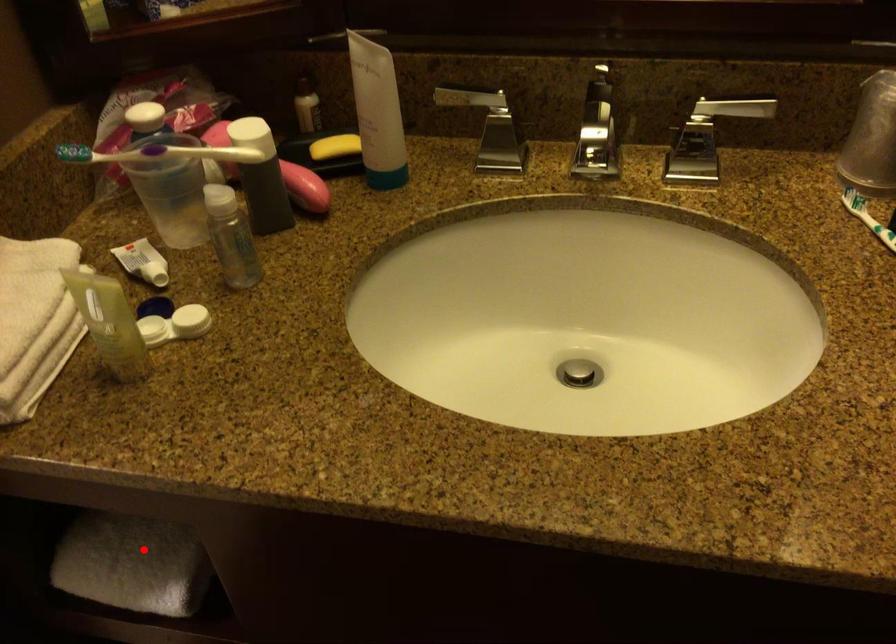
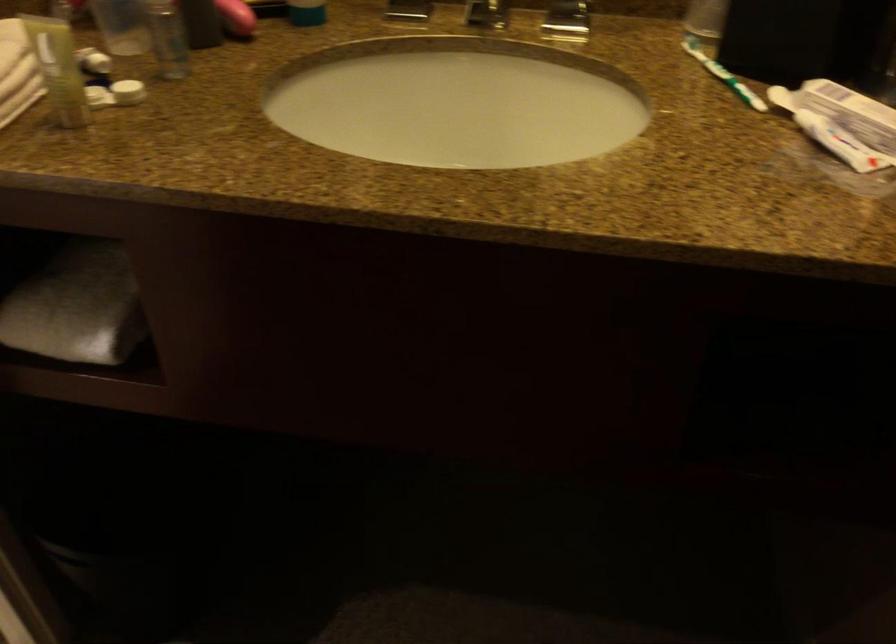
The point at the highlighted location is marked in the first image. Where is the corresponding point in the second image?

(76, 306)